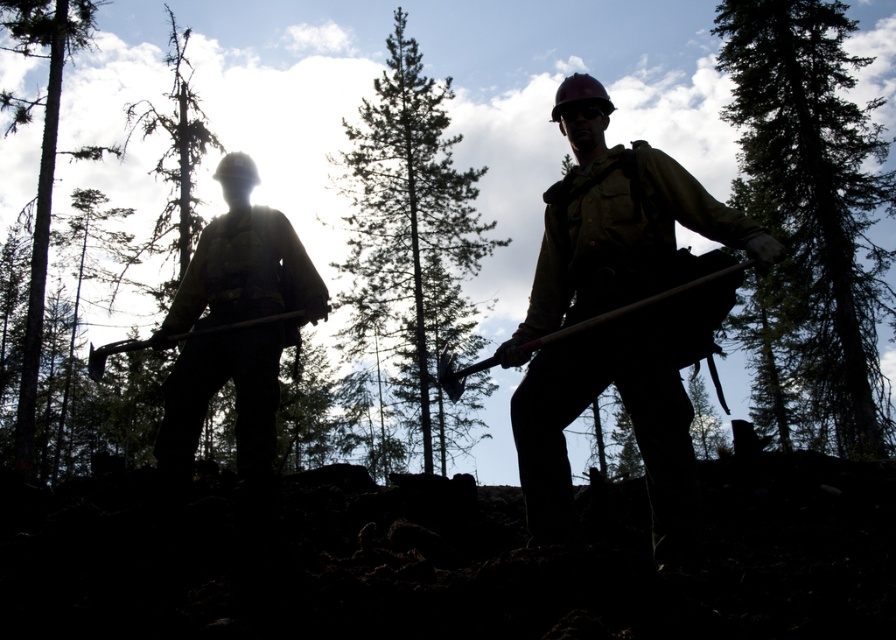
You are a park ranger assessing the forest canopy. You notice two trees in your line of sight. The first is the green textured tree at upper right, and the second is the green textured tree at center. Which tree would cast a shorter shadow during this time of day?

The green textured tree at upper right is shorter than the green textured tree at center, so it would cast a shorter shadow during this time of day.

You are a safety inspector checking the visibility of workers in a forest. You notice the matte yellow safety vest at left and the smooth bark tree at left. Which object is shorter?

The matte yellow safety vest at left is shorter than the smooth bark tree at left.

You are a park ranger who needs to measure the distance between you and the green textured tree at center. Your GPS device shows that you are currently 20 meters away from it. Is the GPS reading accurate?

The green textured tree at center and viewer are 22.17 meters apart from each other, so the GPS reading of 20 meters is inaccurate. The actual distance is approximately 2.17 meters more than the GPS reading.